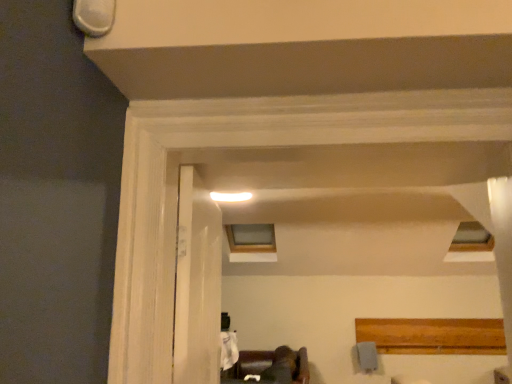
Identify the location of white wood door at center. The image size is (512, 384). (197, 284).

Locate an element on the screen. Image resolution: width=512 pixels, height=384 pixels. dark brown leather couch at lower center is located at coordinates (270, 366).

Measure the distance between clear glass window at upper center and camera.

A distance of 5.15 meters exists between clear glass window at upper center and camera.

Identify the location of white wood door at center. (197, 284).

Is dark brown leather couch at lower center positioned with its back to clear glass window at upper center?

dark brown leather couch at lower center does not have its back to clear glass window at upper center.

Which object is wider, dark brown leather couch at lower center or clear glass window at upper center?

With larger width is clear glass window at upper center.

Is dark brown leather couch at lower center taller than clear glass window at upper center?

No, dark brown leather couch at lower center is not taller than clear glass window at upper center.

Do you think dark brown leather couch at lower center is within clear glass window at upper center, or outside of it?

dark brown leather couch at lower center lies outside clear glass window at upper center.

From their relative heights in the image, would you say clear glass window at upper center is taller or shorter than white wood door at center?

Considering their sizes, clear glass window at upper center has less height than white wood door at center.

Considering the positions of objects clear glass window at upper center and white wood door at center in the image provided, who is more to the left, clear glass window at upper center or white wood door at center?

white wood door at center.

What's the angular difference between clear glass window at upper center and white wood door at center's facing directions?

The facing directions of clear glass window at upper center and white wood door at center are 92.8 degrees apart.

In the image, is dark brown leather couch at lower center on the left side or the right side of white wood door at center?

dark brown leather couch at lower center is positioned on white wood door at center's right side.

From the image's perspective, which is above, dark brown leather couch at lower center or white wood door at center?

From the image's view, white wood door at center is above.

Does dark brown leather couch at lower center have a lesser width compared to white wood door at center?

No, dark brown leather couch at lower center is not thinner than white wood door at center.

Does dark brown leather couch at lower center turn towards white wood door at center?

No, dark brown leather couch at lower center is not aimed at white wood door at center.

Would you say white wood door at center is a long distance from clear glass window at upper center?

Indeed, white wood door at center is not near clear glass window at upper center.

From a real-world perspective, which object rests below the other?

From a 3D spatial view, white wood door at center is below.

Which is more to the left, white wood door at center or clear glass window at upper center?

From the viewer's perspective, white wood door at center appears more on the left side.

Can you confirm if white wood door at center is bigger than dark brown leather couch at lower center?

Incorrect, white wood door at center is not larger than dark brown leather couch at lower center.

Can you confirm if white wood door at center is positioned to the right of dark brown leather couch at lower center?

No, white wood door at center is not to the right of dark brown leather couch at lower center.

Can you confirm if white wood door at center is shorter than dark brown leather couch at lower center?

Incorrect, the height of white wood door at center does not fall short of that of dark brown leather couch at lower center.

Is clear glass window at upper center smaller than dark brown leather couch at lower center?

Incorrect, clear glass window at upper center is not smaller in size than dark brown leather couch at lower center.

In order to click on window on the left of dark brown leather couch at lower center in this screenshot , I will do `click(251, 238)`.

Which is nearer, (x=257, y=251) or (x=257, y=366)?

The point (x=257, y=366) is more forward.

From the image's perspective, is clear glass window at upper center above or below dark brown leather couch at lower center?

Clearly, from the image's perspective, clear glass window at upper center is above dark brown leather couch at lower center.

Where is `window behind the dark brown leather couch at lower center`? This screenshot has height=384, width=512. window behind the dark brown leather couch at lower center is located at coordinates (251, 238).

In the image, there is a white wood door at center. At what (x,y) coordinates should I click in order to perform the action: click on window below it (from the image's perspective). Please return your answer as a coordinate pair (x, y). The height and width of the screenshot is (384, 512). Looking at the image, I should click on (251, 238).

Based on their spatial positions, is white wood door at center or dark brown leather couch at lower center further from clear glass window at upper center?

white wood door at center.

Looking at this image, which object lies nearer to the anchor point white wood door at center, clear glass window at upper center or dark brown leather couch at lower center?

dark brown leather couch at lower center is closer to white wood door at center.

Based on their spatial positions, is clear glass window at upper center or white wood door at center further from dark brown leather couch at lower center?

white wood door at center lies further to dark brown leather couch at lower center than the other object.

Considering their positions, is dark brown leather couch at lower center positioned further to clear glass window at upper center than white wood door at center?

The object further to clear glass window at upper center is white wood door at center.

Estimate the real-world distances between objects in this image. Which object is closer to white wood door at center, dark brown leather couch at lower center or clear glass window at upper center?

dark brown leather couch at lower center.

In the scene shown: Looking at the image, which one is located closer to dark brown leather couch at lower center, white wood door at center or clear glass window at upper center?

clear glass window at upper center is closer to dark brown leather couch at lower center.

The height and width of the screenshot is (384, 512). What are the coordinates of `furniture between white wood door at center and clear glass window at upper center in the front-back direction` in the screenshot? It's located at (270, 366).